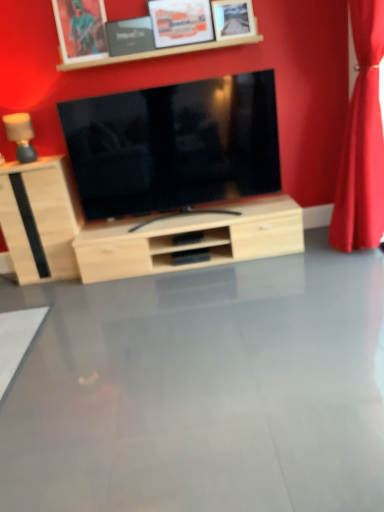
Question: Is point [x=155, y=45] positioned closer to the camera than point [x=24, y=152]?

Choices:
 (A) closer
 (B) farther

Answer: (A)

Question: Considering the positions of wooden picture frame at upper center, the 2th picture frame from the right, and matte wood lamp at left in the image, is wooden picture frame at upper center, the 2th picture frame from the right, wider or thinner than matte wood lamp at left?

Choices:
 (A) thin
 (B) wide

Answer: (A)

Question: Which object is the farthest from the wooden picture frame at upper center, the 2th picture frame from the right?

Choices:
 (A) light wood cabinet at left
 (B) wooden frame at upper center
 (C) red velvet curtain at right
 (D) matte wood lamp at left
 (E) matte black tv at center

Answer: (A)

Question: Estimate the real-world distances between objects in this image. Which object is farther from the matte wood lamp at left?

Choices:
 (A) brushed metal picture frame at upper center, the first picture frame from the left
 (B) matte black tv at center
 (C) wooden frame at upper center
 (D) light wood cabinet at left
 (E) matte black picture frame at upper center, the third picture frame from the right

Answer: (B)